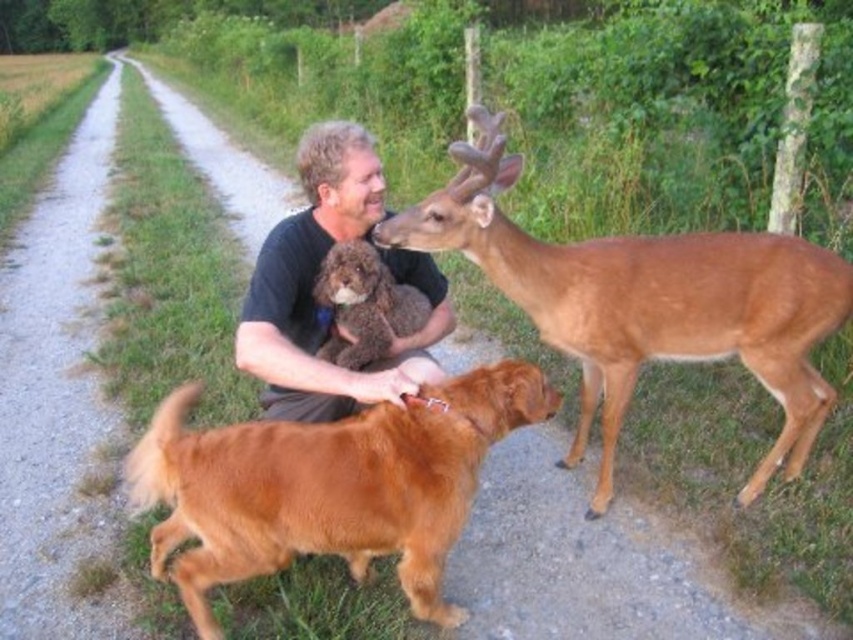
Between brown matte/deer at center and black cotton shirt at center, which one is positioned higher?

black cotton shirt at center is higher up.

Can you confirm if brown matte/deer at center is positioned to the right of black cotton shirt at center?

Yes, brown matte/deer at center is to the right of black cotton shirt at center.

Measure the distance between brown matte/deer at center and camera.

They are 7.34 feet apart.

Locate an element on the screen. The width and height of the screenshot is (853, 640). brown matte/deer at center is located at coordinates (643, 301).

Is brown matte/deer at center positioned at the back of brown plush toy at center?

No, it is not.

Can you confirm if brown matte/deer at center is taller than brown plush toy at center?

Correct, brown matte/deer at center is much taller as brown plush toy at center.

Does point (436, 240) come behind point (372, 301)?

No, (436, 240) is in front of (372, 301).

Where is `brown matte/deer at center`? brown matte/deer at center is located at coordinates (643, 301).

Can you confirm if black cotton shirt at center is wider than brown plush toy at center?

Yes, black cotton shirt at center is wider than brown plush toy at center.

Between point (312, 340) and point (372, 349), which one is positioned behind?

The point (312, 340) is behind.

Where is `black cotton shirt at center`? Image resolution: width=853 pixels, height=640 pixels. black cotton shirt at center is located at coordinates (312, 285).

Image resolution: width=853 pixels, height=640 pixels. In order to click on black cotton shirt at center in this screenshot , I will do `click(312, 285)`.